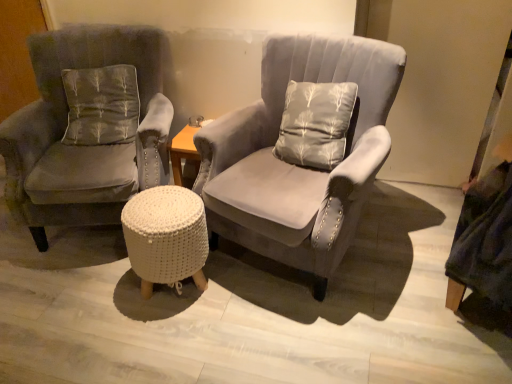
Question: Is suede gray armchair at center, which appears as the second chair when viewed from the left, oriented away from velvet gray armchair at left, which appears as the first chair when viewed from the left?

Choices:
 (A) no
 (B) yes

Answer: (A)

Question: Is suede gray armchair at center, the first chair viewed from the right, directly adjacent to velvet gray armchair at left, the 2th chair viewed from the right?

Choices:
 (A) yes
 (B) no

Answer: (B)

Question: Does suede gray armchair at center, the first chair viewed from the right, have a lesser height compared to velvet gray armchair at left, the 2th chair viewed from the right?

Choices:
 (A) no
 (B) yes

Answer: (A)

Question: Could you tell me if suede gray armchair at center, the first chair viewed from the right, is facing velvet gray armchair at left, the 2th chair viewed from the right?

Choices:
 (A) yes
 (B) no

Answer: (B)

Question: Does suede gray armchair at center, which appears as the second chair when viewed from the left, lie in front of velvet gray armchair at left, which appears as the first chair when viewed from the left?

Choices:
 (A) no
 (B) yes

Answer: (B)

Question: Is suede gray armchair at center, the first chair viewed from the right, at the right side of velvet gray armchair at left, which appears as the first chair when viewed from the left?

Choices:
 (A) no
 (B) yes

Answer: (B)

Question: Is velvet gray armchair at left, which appears as the first chair when viewed from the left, positioned in front of gray fabric pillow at left?

Choices:
 (A) no
 (B) yes

Answer: (B)

Question: Is velvet gray armchair at left, the 2th chair viewed from the right, positioned beyond the bounds of gray fabric pillow at left?

Choices:
 (A) yes
 (B) no

Answer: (A)

Question: Is velvet gray armchair at left, the 2th chair viewed from the right, at the left side of gray fabric pillow at left?

Choices:
 (A) yes
 (B) no

Answer: (A)

Question: Can you confirm if velvet gray armchair at left, which appears as the first chair when viewed from the left, is shorter than gray fabric pillow at left?

Choices:
 (A) yes
 (B) no

Answer: (B)

Question: Is velvet gray armchair at left, which appears as the first chair when viewed from the left, with gray fabric pillow at left?

Choices:
 (A) no
 (B) yes

Answer: (A)

Question: Can you confirm if velvet gray armchair at left, the 2th chair viewed from the right, is smaller than gray fabric pillow at left?

Choices:
 (A) no
 (B) yes

Answer: (A)

Question: From the image's perspective, is gray fabric pillow at left over velvet gray armchair at left, which appears as the first chair when viewed from the left?

Choices:
 (A) yes
 (B) no

Answer: (A)